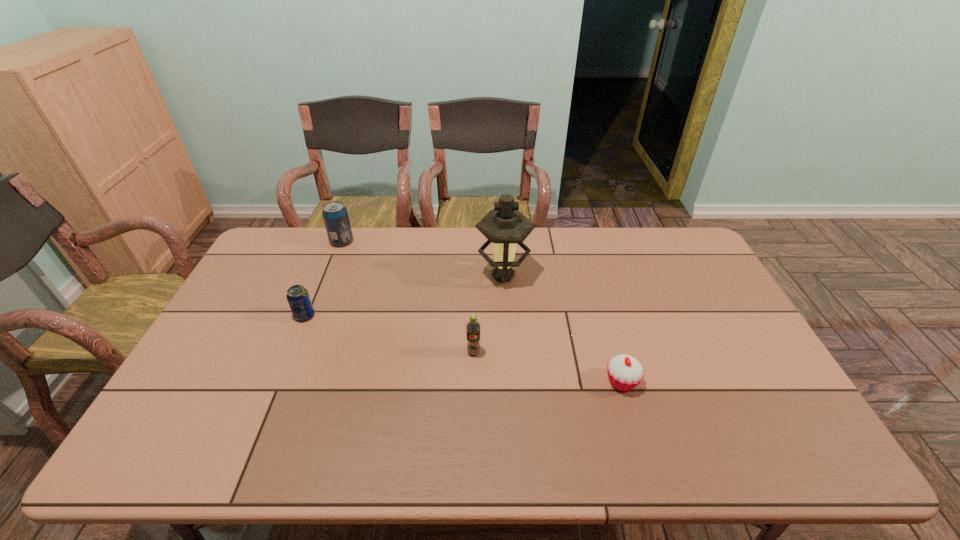
Where is `vacant space located on the right of the farthest object`? This screenshot has height=540, width=960. vacant space located on the right of the farthest object is located at coordinates (444, 241).

Locate an element on the screen. This screenshot has width=960, height=540. vacant space located on the front label of the nearest soda is located at coordinates (472, 467).

Find the location of a particular element. free space located 0.180m on the left of the shortest soda is located at coordinates (236, 316).

Find the location of a particular element. free space located on the right of the nearest object is located at coordinates (722, 382).

The height and width of the screenshot is (540, 960). Identify the location of oil lamp that is positioned at the far edge. (505, 226).

Locate an element on the screen. The image size is (960, 540). pop soda located at the far edge is located at coordinates (335, 215).

Image resolution: width=960 pixels, height=540 pixels. I want to click on vacant space at the far edge of the desktop, so click(642, 242).

At what (x,y) coordinates should I click in order to perform the action: click on vacant region at the near edge. Please return your answer as a coordinate pair (x, y). Image resolution: width=960 pixels, height=540 pixels. Looking at the image, I should click on (564, 445).

Where is `vacant space at the left edge`? The width and height of the screenshot is (960, 540). vacant space at the left edge is located at coordinates (254, 272).

Find the location of a particular element. The height and width of the screenshot is (540, 960). free space at the right edge is located at coordinates (711, 323).